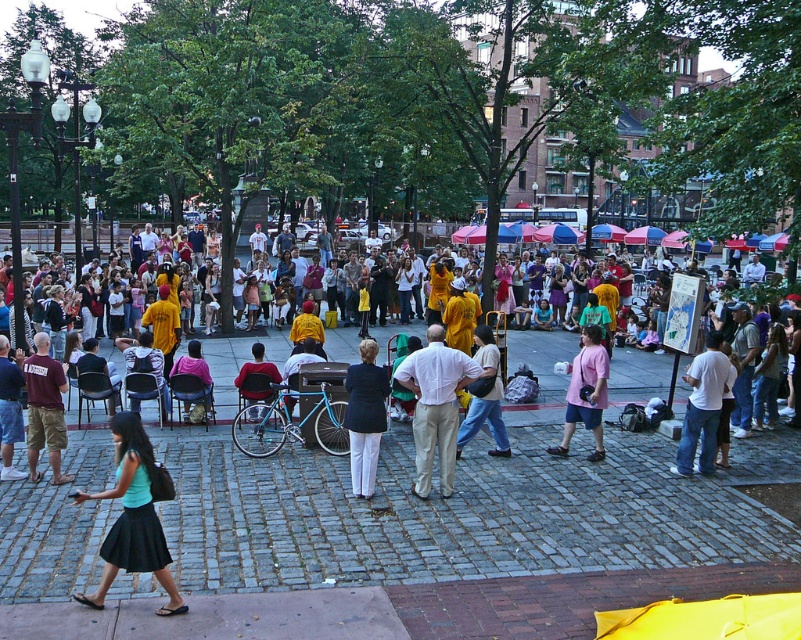
From the picture: Who is higher up, pink fabric shirt at center or matte yellow shirt at center?

matte yellow shirt at center

Is pink fabric shirt at center thinner than matte yellow shirt at center?

Yes.

Between point (204, 390) and point (252, 344), which one is positioned behind?

The point (252, 344) is behind.

Where is `pink fabric shirt at center`? The height and width of the screenshot is (640, 801). pink fabric shirt at center is located at coordinates (199, 380).

Who is more forward, (347, 420) or (558, 445)?

Point (347, 420)

This screenshot has width=801, height=640. Identify the location of matte black blazer at center. (365, 417).

Is white cotton shirt at right closer to camera compared to pink fabric dress at center?

That is False.

Is point (693, 420) closer to camera compared to point (482, 324)?

Yes, it is in front of point (482, 324).

Is point (713, 332) farther from camera compared to point (481, 353)?

Yes, it is behind point (481, 353).

Identify the location of white cotton shirt at right. This screenshot has height=640, width=801. (702, 406).